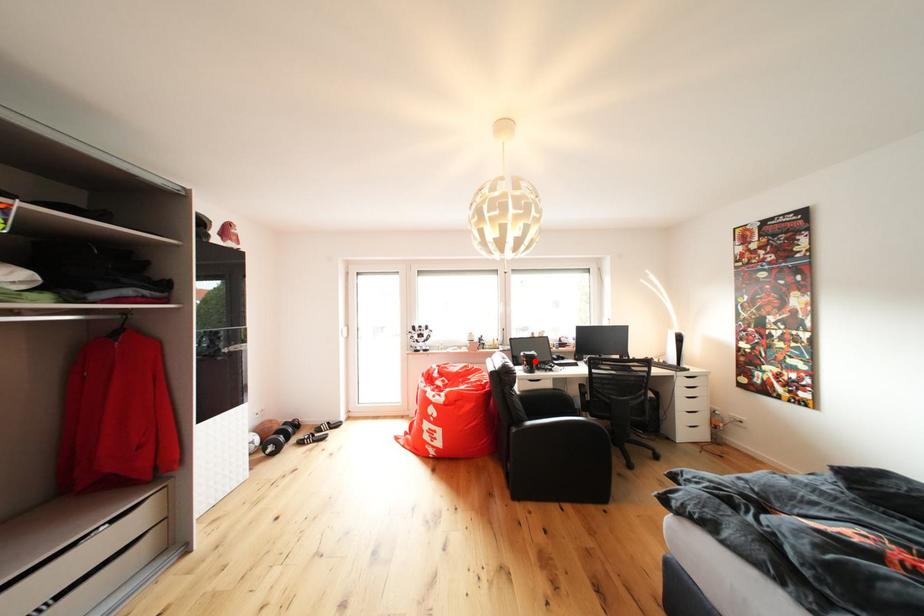
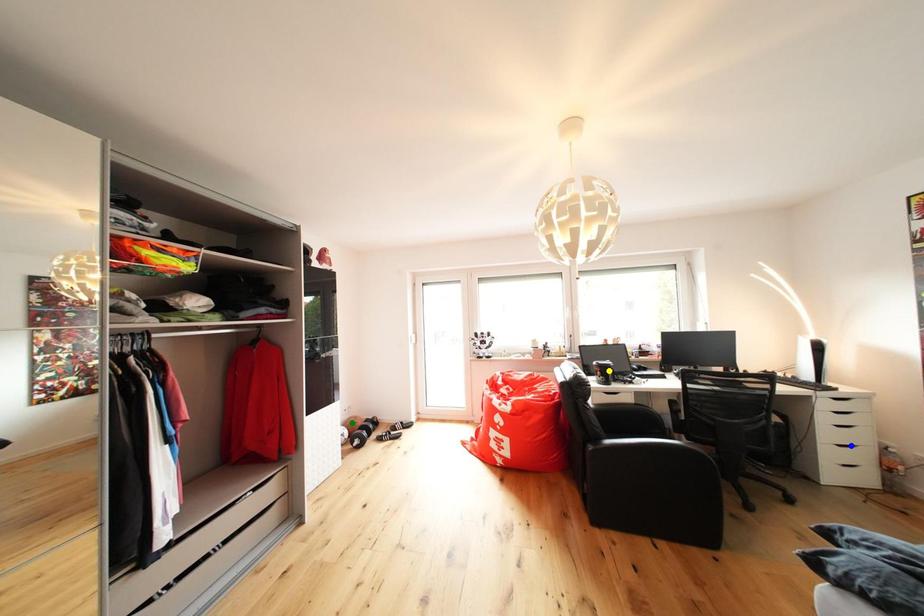
Question: I am providing you with two images of the same scene from different viewpoints. A red point is marked on the first image. You are given multiple points on the second image. Which point in image 2 is actually the same real-world point as the red point in image 1?

Choices:
 (A) green point
 (B) blue point
 (C) yellow point

Answer: (C)